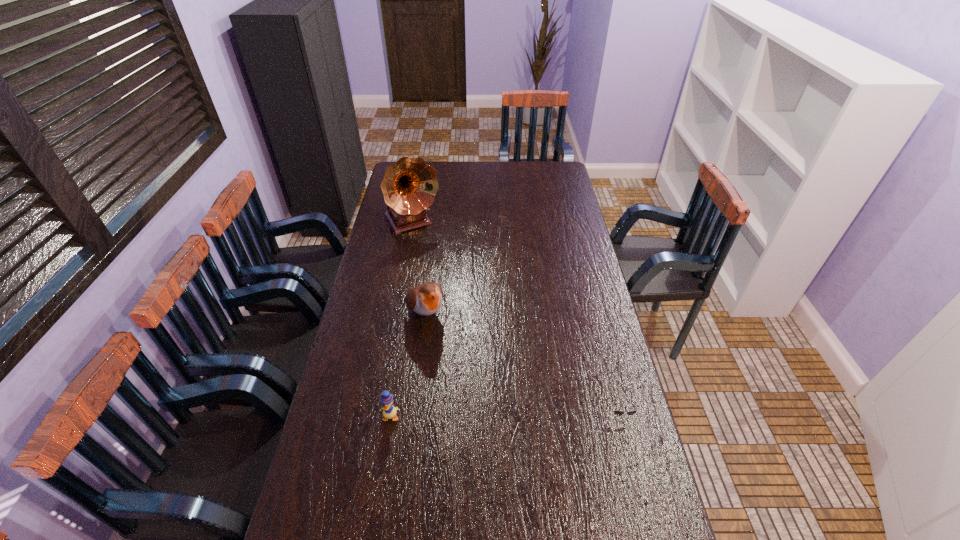
Identify the location of free space on the desktop that is between the third tallest object and the sunglasses and is positioned at the face of the third shortest object. The width and height of the screenshot is (960, 540). (486, 415).

Find the location of a particular element. This screenshot has height=540, width=960. vacant space on the desktop that is between the duckling and the sunglasses and is positioned on the horn of the farthest object is located at coordinates 529,414.